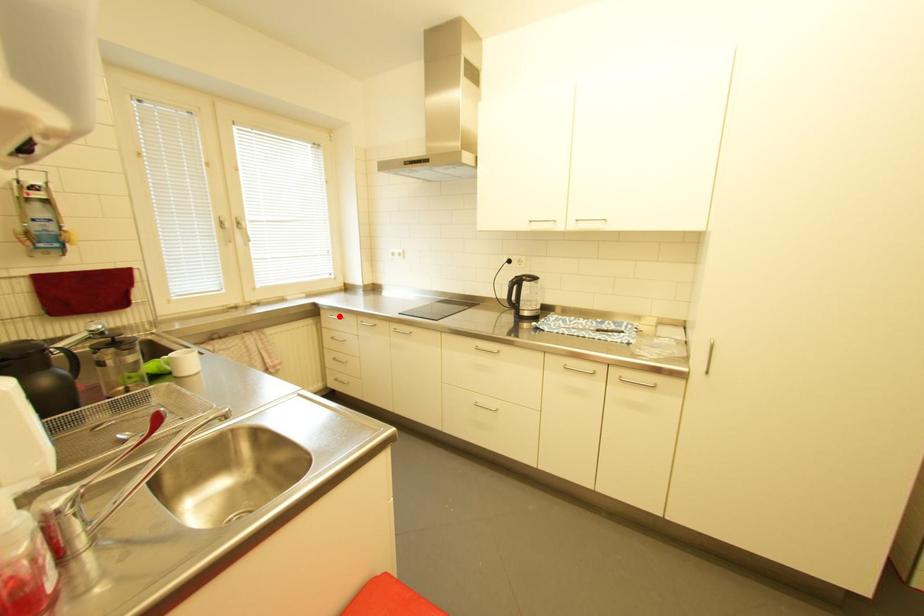
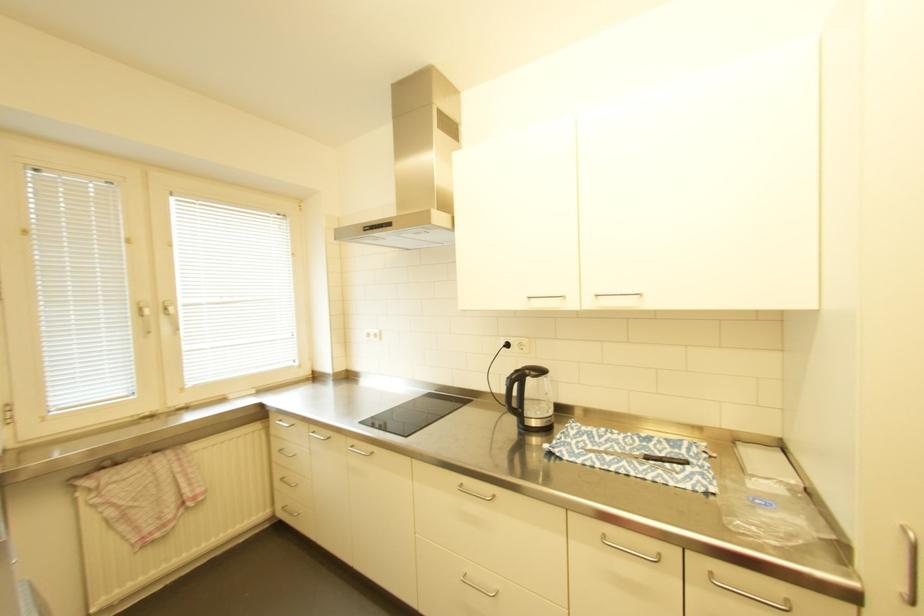
Where in the second image is the point corresponding to the highlighted location from the first image?

(287, 421)